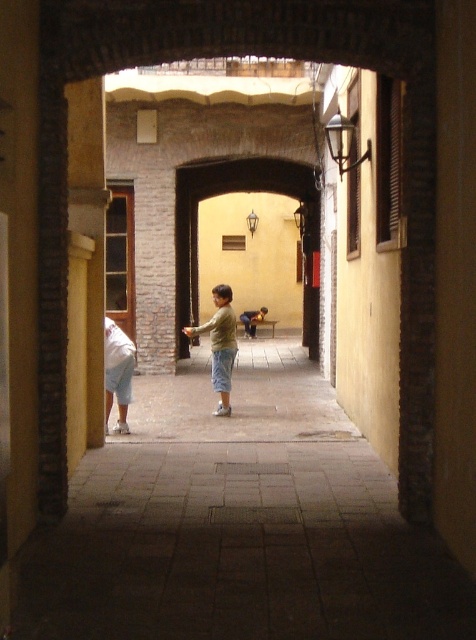
You are standing in the passageway and want to take a photo of both the matte green shirt at center and the white cotton pants at left. Which object should you position closer to the camera to ensure both are fully visible in the frame?

You should position the white cotton pants at left closer to the camera because the matte green shirt at center is already to the right of the white cotton pants at left, meaning it is farther away. By moving the white cotton pants at left forward, both objects will be within the camera frame.

From the picture: You are standing in the passageway and want to find the matte green shirt at center. According to the scene description, where should you look relative to the white cotton pants at left?

The matte green shirt at center is located above the white cotton pants at left, so you should look upwards from the white cotton pants at left to find it.